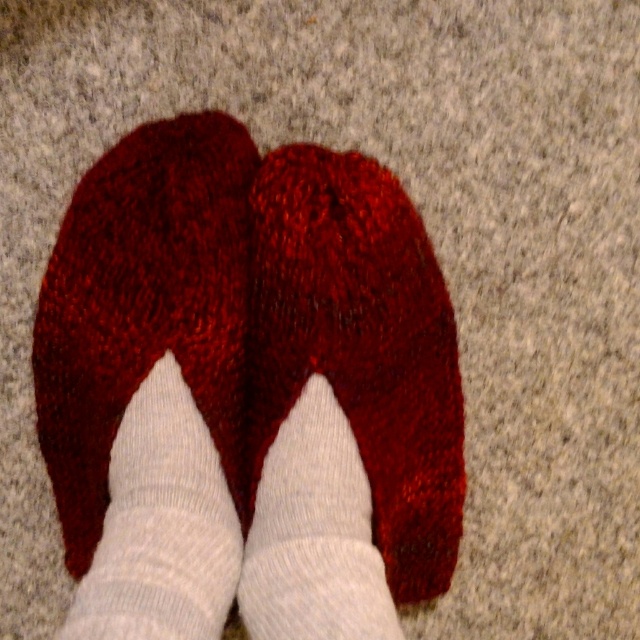
Question: Which point is closer to the camera?

Choices:
 (A) (102, 211)
 (B) (321, 582)
 (C) (177, 492)

Answer: (B)

Question: Which point appears farthest from the camera in this image?

Choices:
 (A) (452, 499)
 (B) (216, 339)

Answer: (A)

Question: Is knitted wool slipper at center positioned at the back of knitted wool sock at center?

Choices:
 (A) yes
 (B) no

Answer: (A)

Question: Among these objects, which one is nearest to the camera?

Choices:
 (A) shiny red slippers at center
 (B) white knitted sock at center
 (C) knitted wool slipper at center

Answer: (B)

Question: Does knitted wool slipper at center have a lesser width compared to white knit sock at center?

Choices:
 (A) no
 (B) yes

Answer: (A)

Question: Is shiny red slippers at center above white knitted sock at center?

Choices:
 (A) yes
 (B) no

Answer: (A)